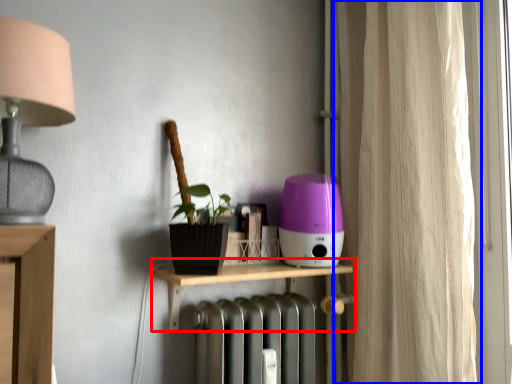
Question: Which point is closer to the camera, shelf (highlighted by a red box) or curtain (highlighted by a blue box)?

Choices:
 (A) shelf
 (B) curtain

Answer: (B)